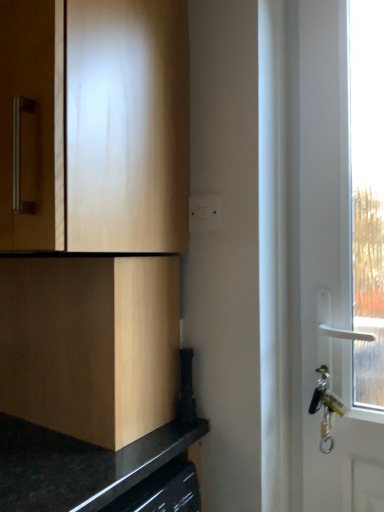
What is the approximate height of light wood cabinet at upper left, marked as the 1th cabinetry in a top-to-bottom arrangement?

The height of light wood cabinet at upper left, marked as the 1th cabinetry in a top-to-bottom arrangement, is 30.51 inches.

Where is `light wood cabinet at upper left, the second cabinetry in the bottom-to-top sequence`? light wood cabinet at upper left, the second cabinetry in the bottom-to-top sequence is located at coordinates (96, 125).

Measure the distance from matte wood cabinet at lower left, acting as the 2th cabinetry starting from the top, to light wood cabinet at upper left, the second cabinetry in the bottom-to-top sequence.

They are 25.97 centimeters apart.

From a real-world perspective, is matte wood cabinet at lower left, which is counted as the first cabinetry, starting from the bottom, physically above light wood cabinet at upper left, the second cabinetry in the bottom-to-top sequence?

Incorrect, from a real-world perspective, matte wood cabinet at lower left, which is counted as the first cabinetry, starting from the bottom, is lower than light wood cabinet at upper left, the second cabinetry in the bottom-to-top sequence.

Does matte wood cabinet at lower left, acting as the 2th cabinetry starting from the top, appear on the left side of light wood cabinet at upper left, marked as the 1th cabinetry in a top-to-bottom arrangement?

Incorrect, matte wood cabinet at lower left, acting as the 2th cabinetry starting from the top, is not on the left side of light wood cabinet at upper left, marked as the 1th cabinetry in a top-to-bottom arrangement.

Based on their sizes in the image, would you say matte wood cabinet at lower left, which is counted as the first cabinetry, starting from the bottom, is bigger or smaller than light wood cabinet at upper left, the second cabinetry in the bottom-to-top sequence?

In the image, matte wood cabinet at lower left, which is counted as the first cabinetry, starting from the bottom, appears to be smaller than light wood cabinet at upper left, the second cabinetry in the bottom-to-top sequence.

Considering the points (211, 196) and (130, 395), which point is behind, point (211, 196) or point (130, 395)?

The point (211, 196) is farther from the camera.

Looking at the image, does white plastic switch at center seem bigger or smaller compared to matte wood cabinet at lower left, acting as the 2th cabinetry starting from the top?

Considering their sizes, white plastic switch at center takes up less space than matte wood cabinet at lower left, acting as the 2th cabinetry starting from the top.

Can you confirm if white plastic switch at center is thinner than matte wood cabinet at lower left, acting as the 2th cabinetry starting from the top?

Indeed, white plastic switch at center has a lesser width compared to matte wood cabinet at lower left, acting as the 2th cabinetry starting from the top.

From the image's perspective, between white plastic switch at center and matte wood cabinet at lower left, which is counted as the first cabinetry, starting from the bottom, which one is located above?

white plastic switch at center is shown above in the image.

Which is behind, point (81, 20) or point (202, 224)?

The point (202, 224) is more distant.

Does light wood cabinet at upper left, the second cabinetry in the bottom-to-top sequence, come behind white plastic switch at center?

No, the depth of light wood cabinet at upper left, the second cabinetry in the bottom-to-top sequence, is less than that of white plastic switch at center.

Is light wood cabinet at upper left, the second cabinetry in the bottom-to-top sequence, outside of white plastic switch at center?

Indeed, light wood cabinet at upper left, the second cabinetry in the bottom-to-top sequence, is completely outside white plastic switch at center.

From their relative heights in the image, would you say light wood cabinet at upper left, the second cabinetry in the bottom-to-top sequence, is taller or shorter than white plastic switch at center?

light wood cabinet at upper left, the second cabinetry in the bottom-to-top sequence, is taller than white plastic switch at center.

Which point is more forward, (204, 220) or (170, 119)?

The point (170, 119) is more forward.

Is white plastic switch at center far from light wood cabinet at upper left, marked as the 1th cabinetry in a top-to-bottom arrangement?

white plastic switch at center is near light wood cabinet at upper left, marked as the 1th cabinetry in a top-to-bottom arrangement, not far away.

In the image, is white plastic switch at center positioned in front of or behind light wood cabinet at upper left, marked as the 1th cabinetry in a top-to-bottom arrangement?

Visually, white plastic switch at center is located behind light wood cabinet at upper left, marked as the 1th cabinetry in a top-to-bottom arrangement.

In the image, is white plastic switch at center on the left side or the right side of light wood cabinet at upper left, marked as the 1th cabinetry in a top-to-bottom arrangement?

white plastic switch at center is to the right of light wood cabinet at upper left, marked as the 1th cabinetry in a top-to-bottom arrangement.

From a real-world perspective, between matte wood cabinet at lower left, which is counted as the first cabinetry, starting from the bottom, and white plastic switch at center, who is vertically higher?

white plastic switch at center, from a real-world perspective.

Consider the image. Considering the sizes of matte wood cabinet at lower left, acting as the 2th cabinetry starting from the top, and white plastic switch at center in the image, is matte wood cabinet at lower left, acting as the 2th cabinetry starting from the top, taller or shorter than white plastic switch at center?

Clearly, matte wood cabinet at lower left, acting as the 2th cabinetry starting from the top, is taller compared to white plastic switch at center.

Looking at this image, based on their sizes in the image, would you say matte wood cabinet at lower left, which is counted as the first cabinetry, starting from the bottom, is bigger or smaller than white plastic switch at center?

In the image, matte wood cabinet at lower left, which is counted as the first cabinetry, starting from the bottom, appears to be larger than white plastic switch at center.

Could you tell me if matte wood cabinet at lower left, acting as the 2th cabinetry starting from the top, is facing white plastic switch at center?

No, matte wood cabinet at lower left, acting as the 2th cabinetry starting from the top, does not turn towards white plastic switch at center.

From a real-world perspective, relative to matte wood cabinet at lower left, which is counted as the first cabinetry, starting from the bottom, is light wood cabinet at upper left, the second cabinetry in the bottom-to-top sequence, vertically above or below?

In terms of real-world spatial position, light wood cabinet at upper left, the second cabinetry in the bottom-to-top sequence, is above matte wood cabinet at lower left, which is counted as the first cabinetry, starting from the bottom.

Consider the image. Which point is more forward, (106, 13) or (135, 281)?

The point (106, 13) is closer.

Considering the relative sizes of light wood cabinet at upper left, the second cabinetry in the bottom-to-top sequence, and matte wood cabinet at lower left, which is counted as the first cabinetry, starting from the bottom, in the image provided, is light wood cabinet at upper left, the second cabinetry in the bottom-to-top sequence, shorter than matte wood cabinet at lower left, which is counted as the first cabinetry, starting from the bottom,?

No.

How distant is light wood cabinet at upper left, the second cabinetry in the bottom-to-top sequence, from matte wood cabinet at lower left, which is counted as the first cabinetry, starting from the bottom?

light wood cabinet at upper left, the second cabinetry in the bottom-to-top sequence, and matte wood cabinet at lower left, which is counted as the first cabinetry, starting from the bottom, are 10.22 inches apart.

Where is `cabinetry on the left of matte wood cabinet at lower left, which is counted as the first cabinetry, starting from the bottom`? Image resolution: width=384 pixels, height=512 pixels. cabinetry on the left of matte wood cabinet at lower left, which is counted as the first cabinetry, starting from the bottom is located at coordinates coord(96,125).

This screenshot has width=384, height=512. What are the coordinates of `electric outlet above the matte wood cabinet at lower left, which is counted as the first cabinetry, starting from the bottom (from a real-world perspective)` in the screenshot? It's located at (204, 213).

Based on their spatial positions, is white plastic switch at center or light wood cabinet at upper left, the second cabinetry in the bottom-to-top sequence, closer to matte wood cabinet at lower left, which is counted as the first cabinetry, starting from the bottom?

Among the two, light wood cabinet at upper left, the second cabinetry in the bottom-to-top sequence, is located nearer to matte wood cabinet at lower left, which is counted as the first cabinetry, starting from the bottom.

Which object lies further to the anchor point white plastic switch at center, light wood cabinet at upper left, marked as the 1th cabinetry in a top-to-bottom arrangement, or matte wood cabinet at lower left, acting as the 2th cabinetry starting from the top?

The object further to white plastic switch at center is matte wood cabinet at lower left, acting as the 2th cabinetry starting from the top.

When comparing their distances from white plastic switch at center, does matte wood cabinet at lower left, acting as the 2th cabinetry starting from the top, or light wood cabinet at upper left, the second cabinetry in the bottom-to-top sequence, seem further?

Among the two, matte wood cabinet at lower left, acting as the 2th cabinetry starting from the top, is located further to white plastic switch at center.

Looking at the image, which one is located closer to light wood cabinet at upper left, marked as the 1th cabinetry in a top-to-bottom arrangement, white plastic switch at center or matte wood cabinet at lower left, which is counted as the first cabinetry, starting from the bottom?

matte wood cabinet at lower left, which is counted as the first cabinetry, starting from the bottom, is closer to light wood cabinet at upper left, marked as the 1th cabinetry in a top-to-bottom arrangement.

Considering their positions, is light wood cabinet at upper left, marked as the 1th cabinetry in a top-to-bottom arrangement, positioned further to matte wood cabinet at lower left, acting as the 2th cabinetry starting from the top, than white plastic switch at center?

white plastic switch at center is further to matte wood cabinet at lower left, acting as the 2th cabinetry starting from the top.

Looking at the image, which one is located further to light wood cabinet at upper left, the second cabinetry in the bottom-to-top sequence, matte wood cabinet at lower left, which is counted as the first cabinetry, starting from the bottom, or white plastic switch at center?

white plastic switch at center lies further to light wood cabinet at upper left, the second cabinetry in the bottom-to-top sequence, than the other object.

This screenshot has height=512, width=384. Find the location of `electric outlet between light wood cabinet at upper left, marked as the 1th cabinetry in a top-to-bottom arrangement, and matte wood cabinet at lower left, acting as the 2th cabinetry starting from the top, from top to bottom`. electric outlet between light wood cabinet at upper left, marked as the 1th cabinetry in a top-to-bottom arrangement, and matte wood cabinet at lower left, acting as the 2th cabinetry starting from the top, from top to bottom is located at coordinates 204,213.